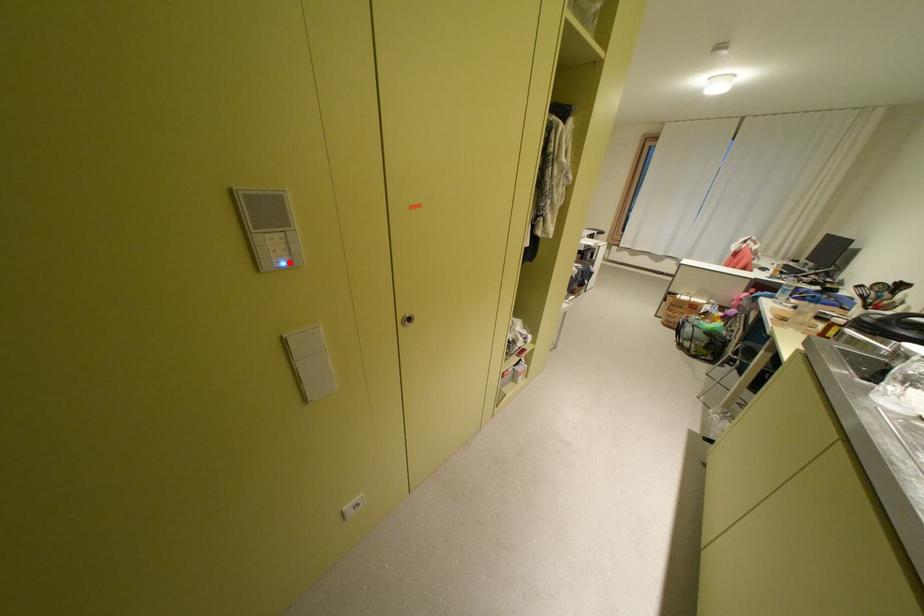
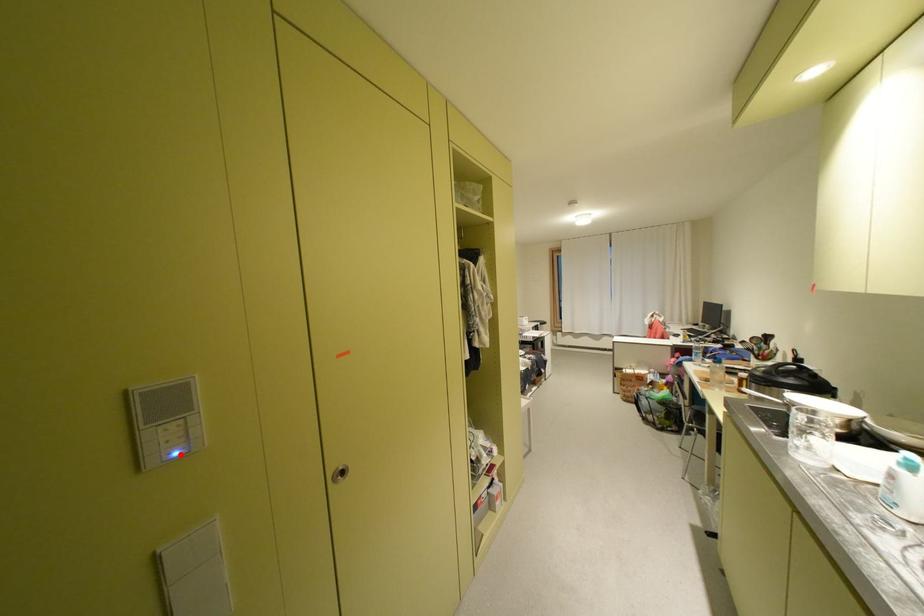
I am providing you with two images of the same scene from different viewpoints. A red point is marked on the first image and another point is marked on the second image. Is the red point in image1 aligned with the point shown in image2?

Yes